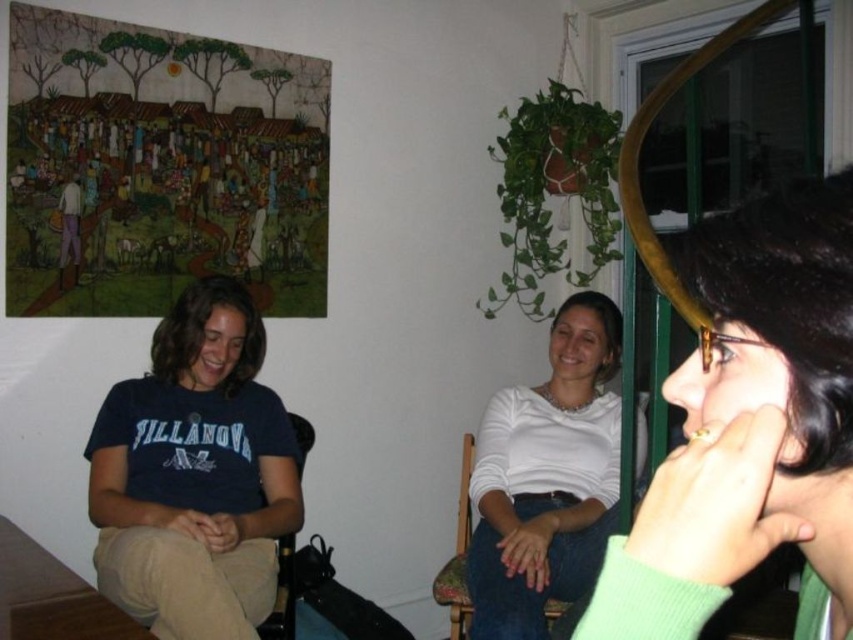
Question: Does green matte sweater at right appear on the right side of blue cotton shirt at left?

Choices:
 (A) yes
 (B) no

Answer: (A)

Question: Is green matte sweater at right further to camera compared to wooden chair at center?

Choices:
 (A) yes
 (B) no

Answer: (B)

Question: Which point is closer to the camera taking this photo?

Choices:
 (A) (461, 548)
 (B) (281, 588)
 (C) (189, 346)
 (D) (480, 460)

Answer: (C)

Question: Is green matte sweater at right in front of brown leather chair at lower left?

Choices:
 (A) yes
 (B) no

Answer: (A)

Question: Which point is closer to the camera?

Choices:
 (A) wooden chair at center
 (B) brown leather chair at lower left

Answer: (A)

Question: Which of these objects is positioned farthest from the blue cotton shirt at left?

Choices:
 (A) brown leather chair at lower left
 (B) wooden chair at center

Answer: (B)